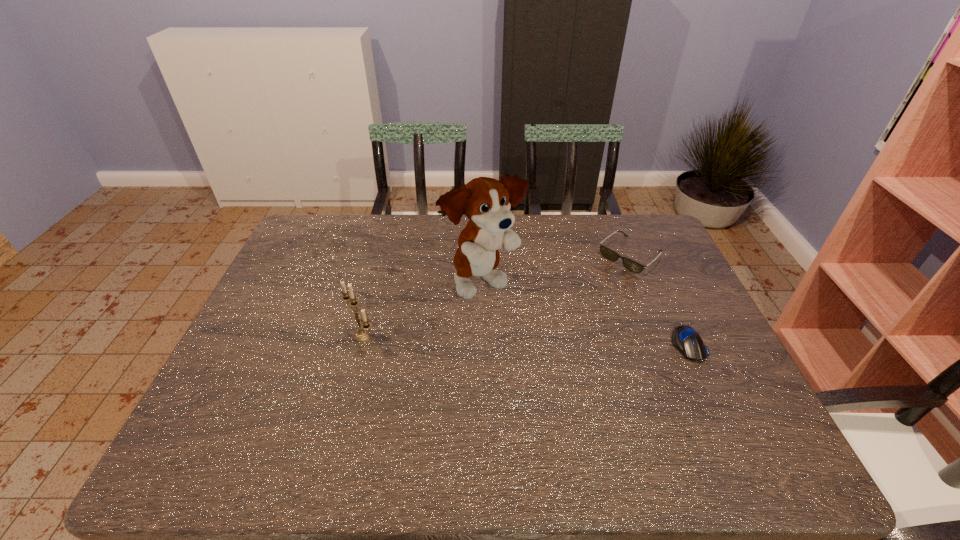
The height and width of the screenshot is (540, 960). Find the location of `free space located 0.190m on the front-facing side of the second shortest object`. free space located 0.190m on the front-facing side of the second shortest object is located at coordinates (577, 301).

Locate an element on the screen. The image size is (960, 540). vacant area located 0.120m on the face of the tallest object is located at coordinates (546, 326).

The image size is (960, 540). Identify the location of vacant region located 0.290m on the face of the tallest object. (600, 361).

You are a GUI agent. You are given a task and a screenshot of the screen. Output one action in this format:
    pyautogui.click(x=<x>, y=<y>)
    Task: Click on the vacant space positioned 0.350m on the face of the tallest object
    The height and width of the screenshot is (540, 960).
    Given the screenshot: What is the action you would take?
    pyautogui.click(x=621, y=375)

Find the location of `object present at the far edge`. object present at the far edge is located at coordinates (606, 252).

Find the location of a particular element. The height and width of the screenshot is (540, 960). computer mouse at the right edge is located at coordinates pos(685,339).

Where is `sunglasses that is at the right edge`? The height and width of the screenshot is (540, 960). sunglasses that is at the right edge is located at coordinates (606, 252).

Locate an element on the screen. The height and width of the screenshot is (540, 960). object present at the far right corner is located at coordinates (606, 252).

You are a GUI agent. You are given a task and a screenshot of the screen. Output one action in this format:
    pyautogui.click(x=<x>, y=<y>)
    Task: Click on the vacant space at the far edge
    
    Given the screenshot: What is the action you would take?
    pyautogui.click(x=572, y=239)

In order to click on vacant position at the near edge of the desktop in this screenshot , I will do `click(340, 426)`.